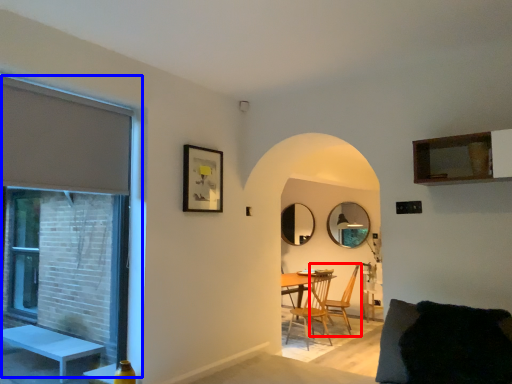
Question: Which of the following is the farthest to the observer, chair (highlighted by a red box) or window (highlighted by a blue box)?

Choices:
 (A) chair
 (B) window

Answer: (A)